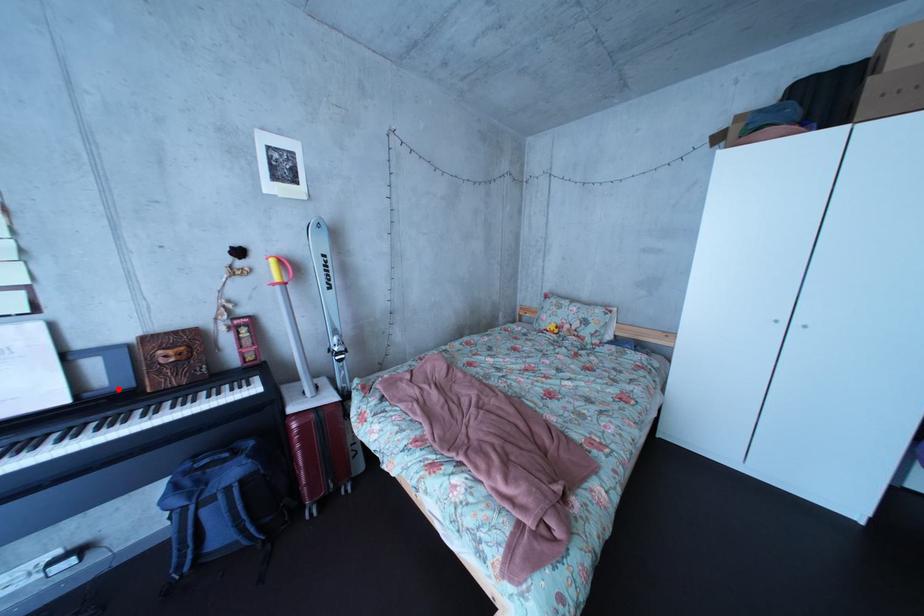
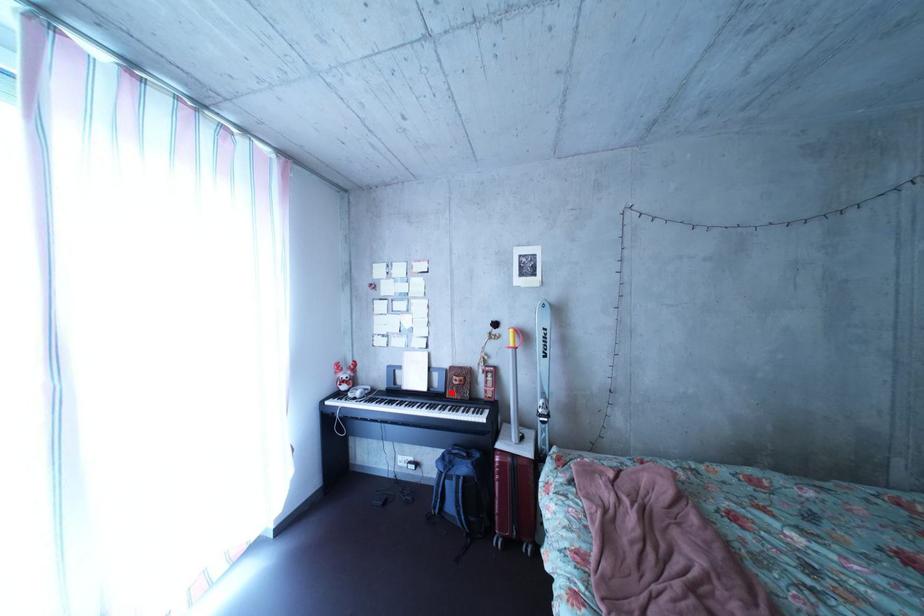
I am providing you with two images of the same scene from different viewpoints. A red point is marked on the first image and another point is marked on the second image. Is the marked point in image1 the same physical position as the marked point in image2?

Yes